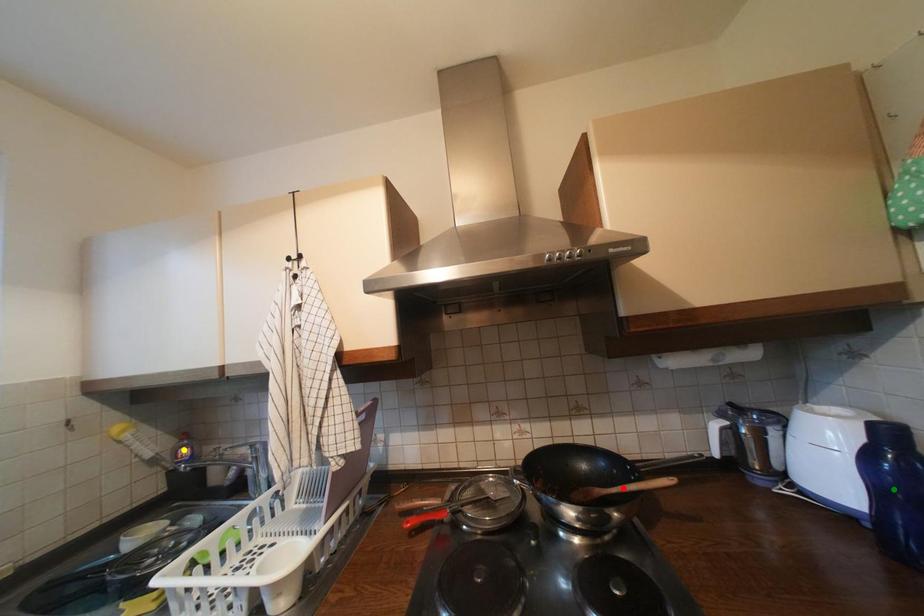
Order these from farthest to nearest:
yellow point | red point | green point

yellow point, red point, green point